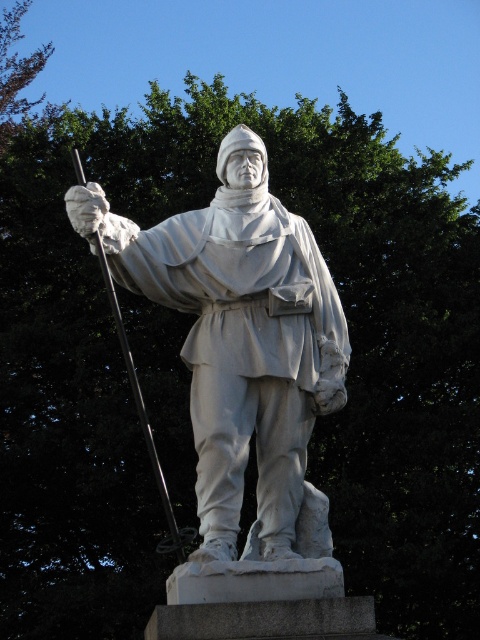
Who is more forward, (199, 515) or (130, 380)?

Point (199, 515)

Which is more to the right, white marble statue at center or white marble pole at center?

white marble statue at center is more to the right.

Between point (192, 307) and point (111, 282), which one is positioned in front?

Point (111, 282) is more forward.

Locate an element on the screen. The image size is (480, 640). white marble statue at center is located at coordinates (239, 337).